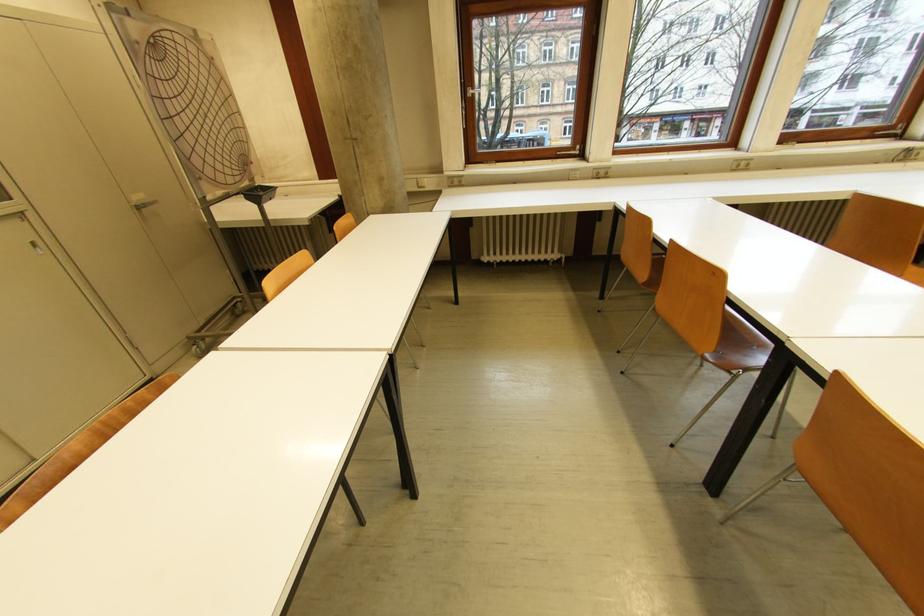
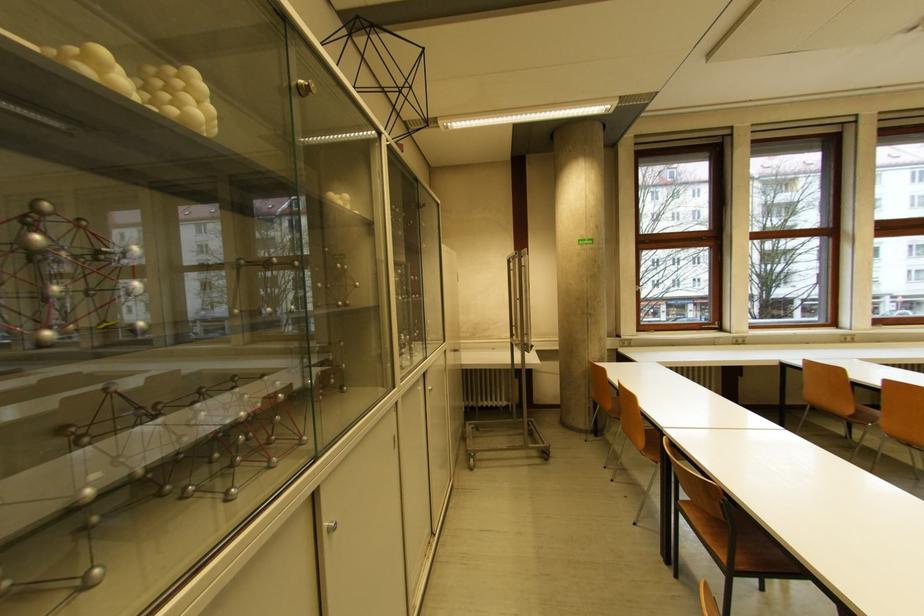
From the picture: In a continuous first-person perspective shot, in which direction is the camera moving?

The cameraman moved toward left, backward.